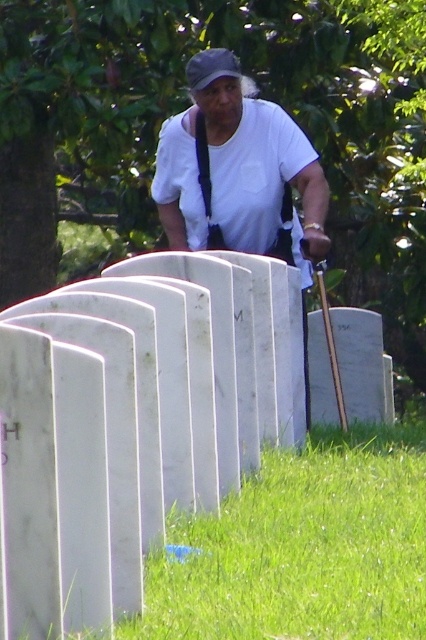
Who is more distant from viewer, (175, 396) or (209, 234)?

The point (209, 234) is behind.

The width and height of the screenshot is (426, 640). Describe the element at coordinates (135, 420) in the screenshot. I see `white marble gravestones at center` at that location.

Who is more distant from viewer, (152, 544) or (268, 252)?

The point (268, 252) is more distant.

Locate an element on the screen. The width and height of the screenshot is (426, 640). white marble gravestones at center is located at coordinates (135, 420).